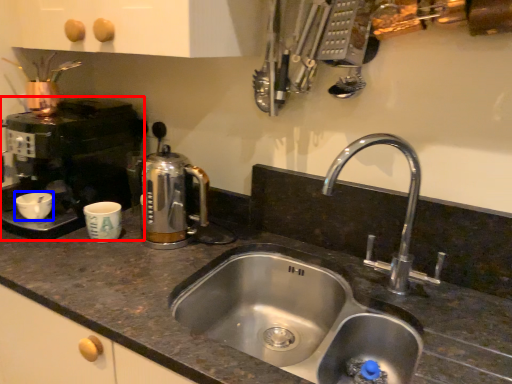
Question: Which object appears closest to the camera in this image, coffee machine (highlighted by a red box) or basin (highlighted by a blue box)?

Choices:
 (A) coffee machine
 (B) basin

Answer: (A)